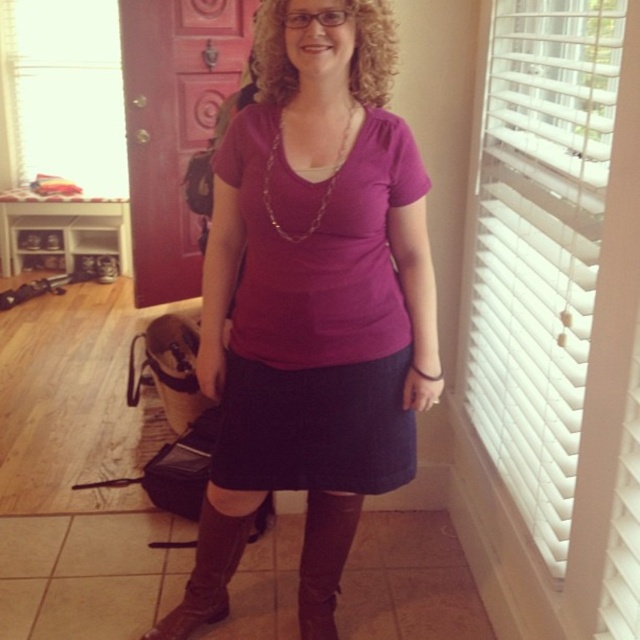
Question: Which object appears closest to the camera in this image?

Choices:
 (A) gold chain necklace at center
 (B) leather at center
 (C) dark blue fabric skirt at center
 (D) brown leather boot at lower center

Answer: (A)

Question: Which of the following is the farthest from the observer?

Choices:
 (A) dark blue fabric skirt at center
 (B) gold chain necklace at center
 (C) brown leather boot at lower center

Answer: (C)

Question: Is matte purple shirt at center smaller than brown leather boot at lower center?

Choices:
 (A) no
 (B) yes

Answer: (A)

Question: Does brown leather boot at lower center come in front of leather at center?

Choices:
 (A) no
 (B) yes

Answer: (B)

Question: Can you confirm if matte purple shirt at center is positioned above brown leather boot at lower center?

Choices:
 (A) no
 (B) yes

Answer: (B)

Question: Which of the following is the closest to the observer?

Choices:
 (A) (234, 472)
 (B) (269, 177)
 (C) (321, 609)
 (D) (216, 605)

Answer: (B)